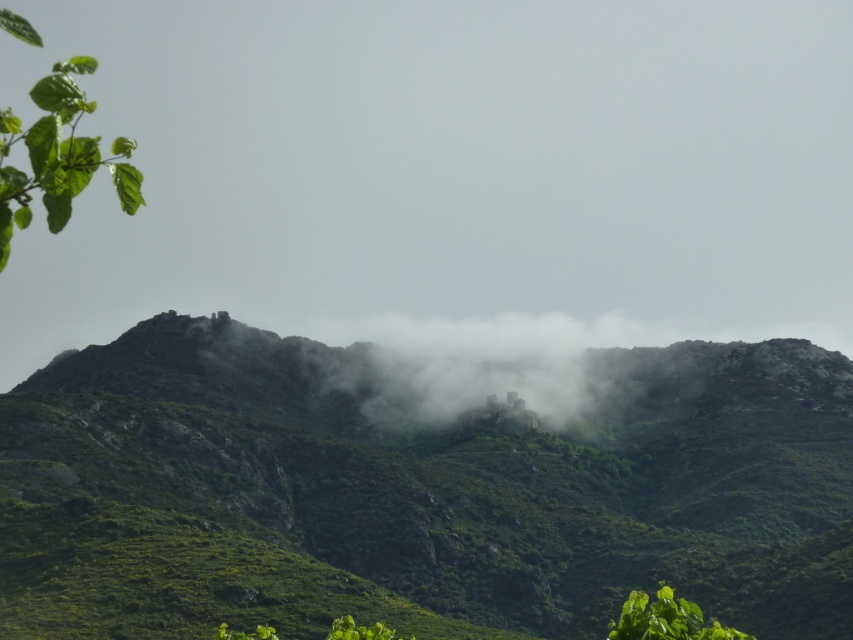
Can you confirm if foggy misty castle at center is positioned to the right of green leafy branch at upper left?

Indeed, foggy misty castle at center is positioned on the right side of green leafy branch at upper left.

Where is `foggy misty castle at center`? Image resolution: width=853 pixels, height=640 pixels. foggy misty castle at center is located at coordinates [x=482, y=360].

Is green leafy branch at upper left to the left of green leafy plant at lower right from the viewer's perspective?

Correct, you'll find green leafy branch at upper left to the left of green leafy plant at lower right.

Is point (83, 60) positioned after point (683, 600)?

No, (83, 60) is in front of (683, 600).

Does point (117, 196) come farther from viewer compared to point (695, 632)?

That is True.

Where is `green leafy branch at upper left`? green leafy branch at upper left is located at coordinates (57, 156).

Between green rocky mountain at upper center and foggy misty castle at center, which one has more height?

With more height is green rocky mountain at upper center.

Can you confirm if green rocky mountain at upper center is smaller than foggy misty castle at center?

Actually, green rocky mountain at upper center might be larger than foggy misty castle at center.

I want to click on green rocky mountain at upper center, so tap(426, 488).